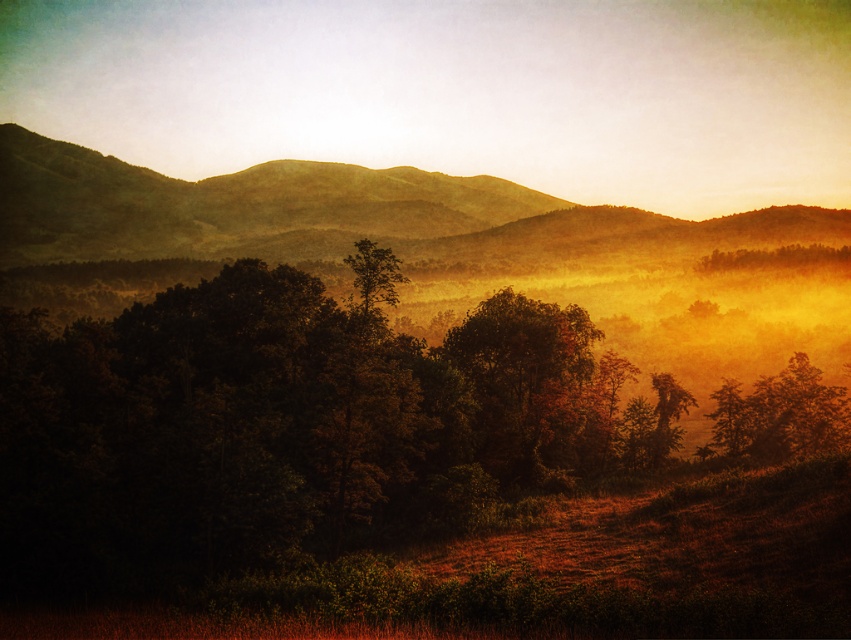
Can you confirm if dark green foliage at center is positioned to the left of green matte tree at center?

Correct, you'll find dark green foliage at center to the left of green matte tree at center.

Which is below, dark green foliage at center or green matte tree at center?

green matte tree at center is below.

Who is more forward, (260, 490) or (567, 385)?

Point (260, 490) is more forward.

Locate an element on the screen. This screenshot has width=851, height=640. dark green foliage at center is located at coordinates (292, 426).